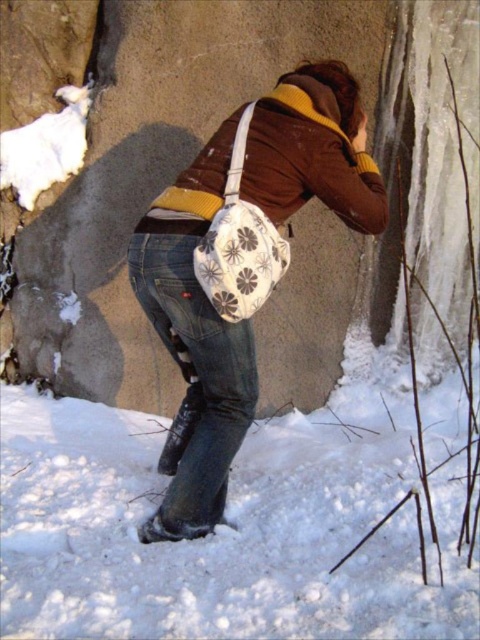
You are a hiker trying to place your floral fabric bag at center safely on the ground near the white fluffy snow at lower left. Given that your bag is 30 centimeters wide, will it fit without overlapping the snow?

The distance between the white fluffy snow at lower left and floral fabric bag at center is 60.47 centimeters. Since the bag is 30 centimeters wide, there is enough space to place it without overlapping the snow.

You are a hiker trying to locate a hidden treasure marked by a specific coordinate on your map. The treasure is buried at point (226, 528). According to the image, what is at that coordinate?

The point (226, 528) marks white fluffy snow at lower left.